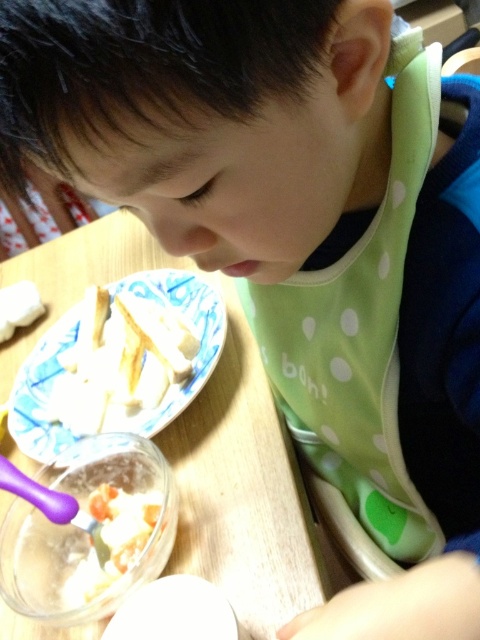
You are a parent trying to clean up after your child. You need to reach the white creamy food at center on the table. Is the green dotted bib at center blocking your direct path to it?

The green dotted bib at center is closer to the viewer than the white creamy food at center, so the bib is in front of the food and blocking the direct path.

You are a parent trying to clean up after your child. You need to determine which item, the green dotted bib at center or the wooden table at center, requires more space to store. Based on the scene, which one is larger?

The wooden table at center is larger than the green dotted bib at center, so it requires more space to store.